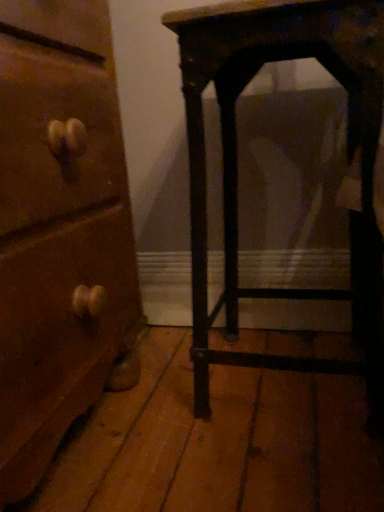
Find the location of a particular element. vacant space positioned to the left of dark wood table at right is located at coordinates (175, 394).